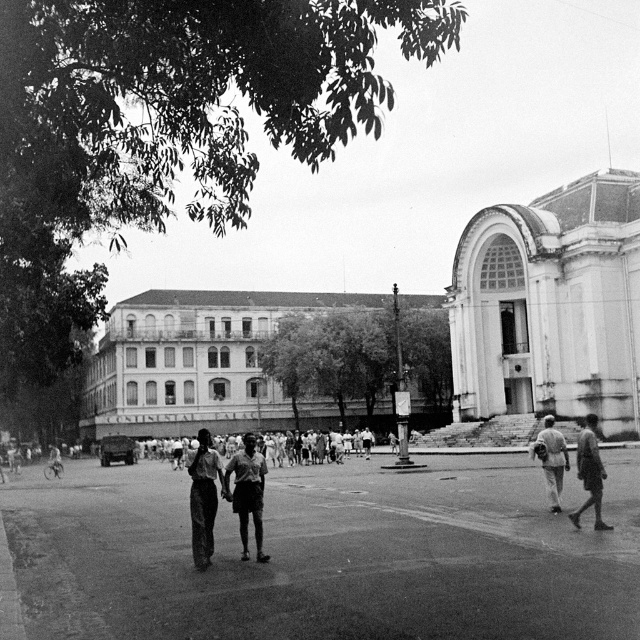
Question: Does dark gray pants at center have a greater width compared to dark skin human at center?

Choices:
 (A) yes
 (B) no

Answer: (A)

Question: Does smooth asphalt plaza at center appear under dark skin human at center?

Choices:
 (A) yes
 (B) no

Answer: (A)

Question: Which point is closer to the camera?

Choices:
 (A) light gray fabric pants at lower right
 (B) dark gray pants at center
 (C) dark skin textured shorts at center
 (D) dark skin human at center

Answer: (B)

Question: Among these points, which one is nearest to the camera?

Choices:
 (A) (378, 529)
 (B) (256, 513)
 (C) (556, 477)

Answer: (B)

Question: Is smooth asphalt plaza at center to the right of dark skin textured shorts at center from the viewer's perspective?

Choices:
 (A) yes
 (B) no

Answer: (A)

Question: Which of the following is the closest to the observer?

Choices:
 (A) dark skin textured shorts at center
 (B) dark skin human at center

Answer: (A)